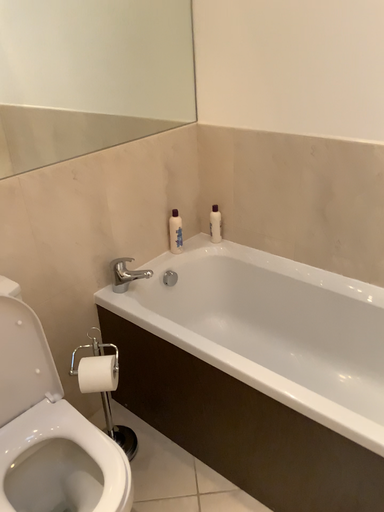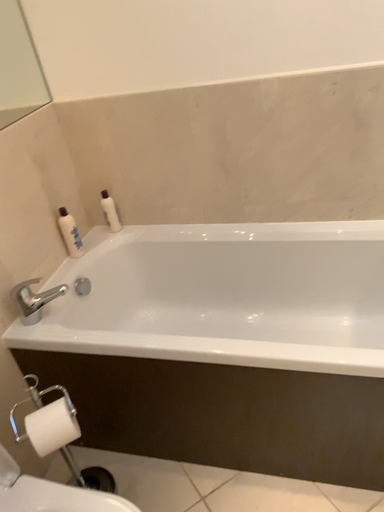
Question: Which way did the camera rotate in the video?

Choices:
 (A) rotated right
 (B) rotated left

Answer: (A)